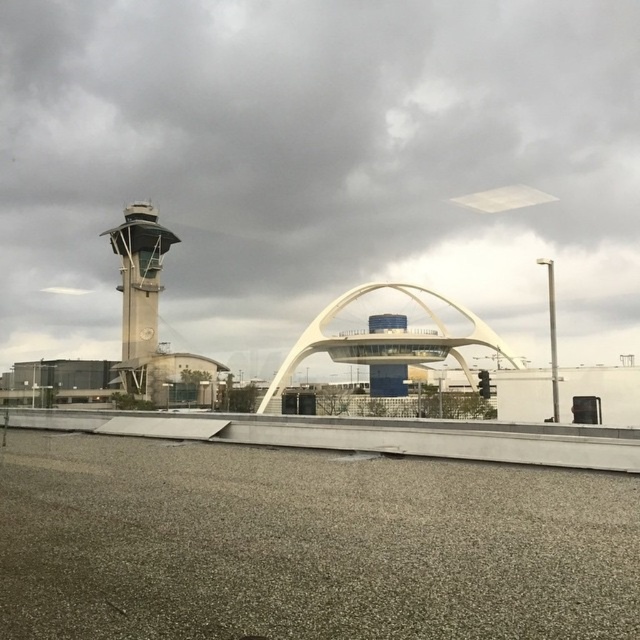
You are standing at the point marked by point (317, 164). Looking around, you see the white matte arch at center. Which direction should you face to look directly at the white matte arch at center?

You are already facing the white matte arch at center because the point (317, 164) marks its location, so you are at the arch itself.

You are a photographer wanting to capture the white smooth arch at center and the concrete control tower at left in the same frame. Which object should you position closer to the camera to ensure both fit in the shot?

Since the white smooth arch at center is wider than the concrete control tower at left, you should position the white smooth arch at center closer to the camera to ensure both fit in the shot.

You are a drone operator planning to fly a drone with a maximum flight height of 10 meters. You need to ensure the drone stays below the white matte arch at center and the concrete control tower at left. Which structure requires you to set a lower maximum altitude limit for the drone?

The concrete control tower at left requires a lower maximum altitude limit because the white matte arch at center has a greater height, so the drone must stay below the shorter structure to comply with both height restrictions.